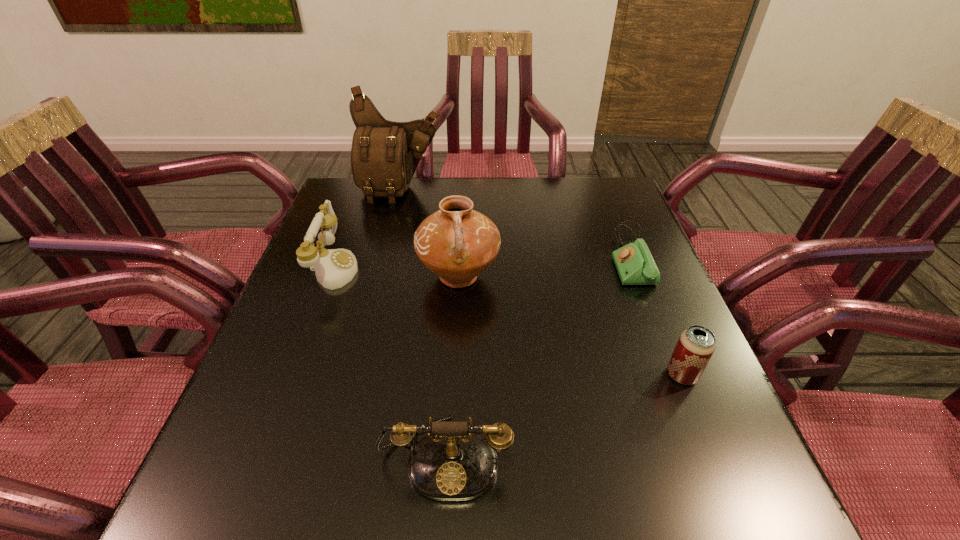
At what (x,y) coordinates should I click in order to perform the action: click on object identified as the fifth closest to the second nearest object. Please return your answer as a coordinate pair (x, y). Image resolution: width=960 pixels, height=540 pixels. Looking at the image, I should click on (384, 156).

Find the location of a particular element. the third closest telephone to the pottery is located at coordinates (635, 265).

This screenshot has height=540, width=960. I want to click on telephone that stands as the second closest to the leftmost telephone, so pyautogui.click(x=635, y=265).

The height and width of the screenshot is (540, 960). What are the coordinates of `free space that satisfies the following two spatial constraints: 1. on the dial of the rightmost telephone; 2. on the side of the second tallest object with the handle` in the screenshot? It's located at (637, 276).

Where is `free spot that satisfies the following two spatial constraints: 1. on the front-facing side of the farthest object; 2. on the dial of the leftmost telephone`? This screenshot has width=960, height=540. free spot that satisfies the following two spatial constraints: 1. on the front-facing side of the farthest object; 2. on the dial of the leftmost telephone is located at coordinates (381, 268).

Locate an element on the screen. Image resolution: width=960 pixels, height=540 pixels. vacant space that satisfies the following two spatial constraints: 1. on the front-facing side of the tallest object; 2. on the right side of the second shortest object is located at coordinates (354, 375).

The image size is (960, 540). Identify the location of vacant space that satisfies the following two spatial constraints: 1. on the front-facing side of the shoulder bag; 2. on the dial of the leftmost telephone. (381, 268).